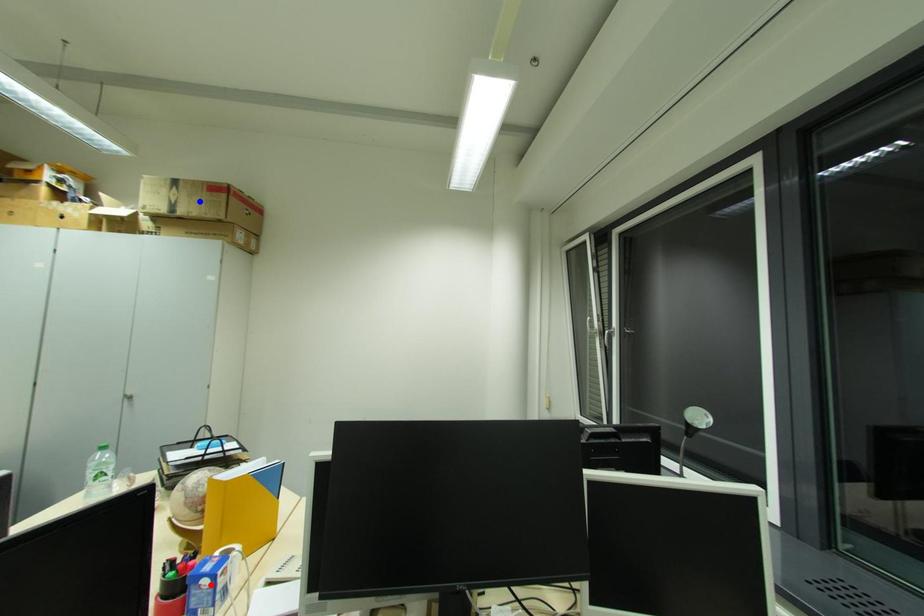
Question: Which of the two points in the image is closer to the camera?

Choices:
 (A) Blue point is closer.
 (B) Red point is closer.

Answer: (B)